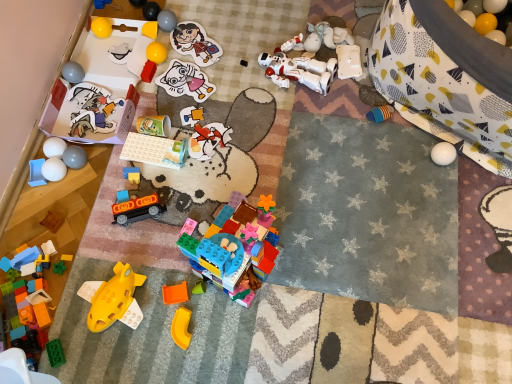
Find the location of `vacant region to the left of white matte balls at left, placed as the 22th toy when sorted from right to left`. vacant region to the left of white matte balls at left, placed as the 22th toy when sorted from right to left is located at coordinates (26, 180).